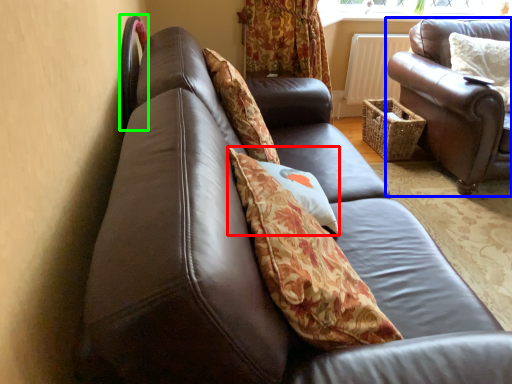
Question: Estimate the real-world distances between objects in this image. Which object is farther from pillow (highlighted by a red box), studio couch (highlighted by a blue box) or chair (highlighted by a green box)?

Choices:
 (A) studio couch
 (B) chair

Answer: (A)